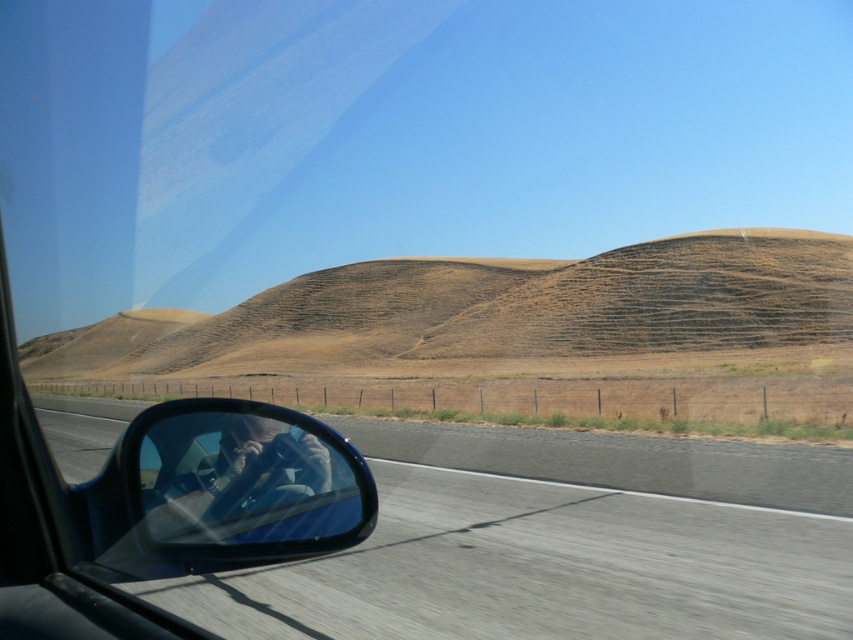
Question: Is smooth asphalt highway at center in front of clear plastic side mirror at lower left?

Choices:
 (A) no
 (B) yes

Answer: (A)

Question: Is smooth asphalt highway at center to the right of clear plastic side mirror at lower left from the viewer's perspective?

Choices:
 (A) yes
 (B) no

Answer: (A)

Question: Which object is farther from the camera taking this photo?

Choices:
 (A) smooth asphalt highway at center
 (B) clear plastic side mirror at lower left

Answer: (A)

Question: Which point is closer to the camera?

Choices:
 (A) (412, 440)
 (B) (161, 403)

Answer: (A)

Question: Is smooth asphalt highway at center behind clear plastic side mirror at lower left?

Choices:
 (A) no
 (B) yes

Answer: (B)